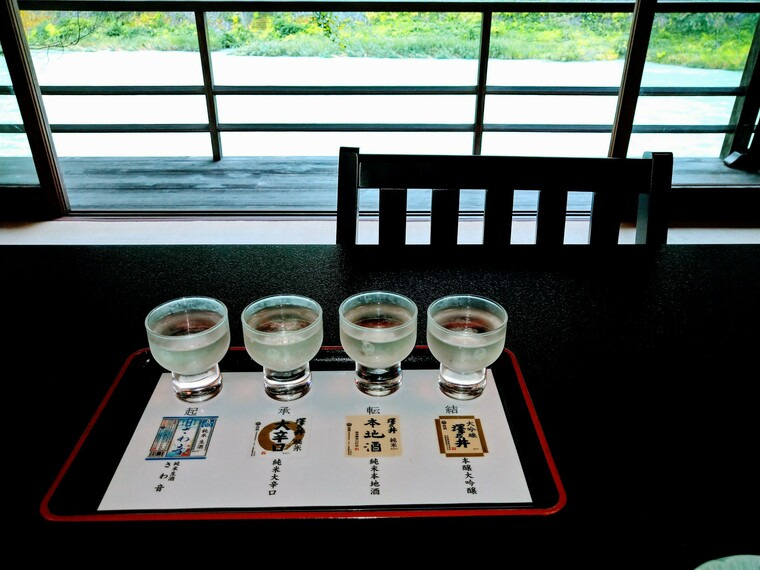
In order to click on chair in this screenshot , I will do `click(517, 177)`.